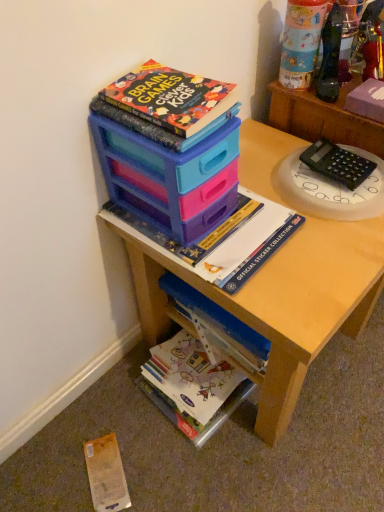
The width and height of the screenshot is (384, 512). I want to click on free point above matte plastic storage at upper center, the second book from the top (from a real-world perspective), so click(x=202, y=225).